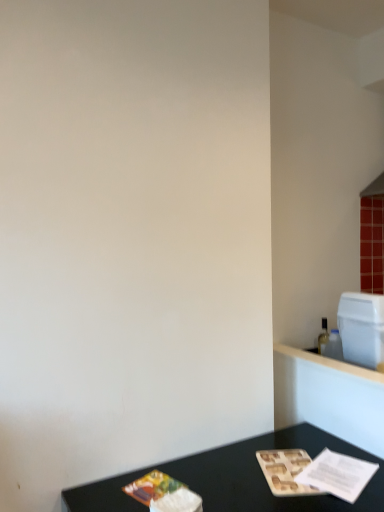
Question: From a real-world perspective, relative to black matte table at lower center, is white plastic container at upper right vertically above or below?

Choices:
 (A) above
 (B) below

Answer: (A)

Question: Is white plastic container at upper right wider or thinner than black matte table at lower center?

Choices:
 (A) wide
 (B) thin

Answer: (B)

Question: Is white plastic container at upper right inside the boundaries of black matte table at lower center, or outside?

Choices:
 (A) outside
 (B) inside

Answer: (A)

Question: Is black matte table at lower center taller or shorter than white plastic container at upper right?

Choices:
 (A) short
 (B) tall

Answer: (B)

Question: From a real-world perspective, is black matte table at lower center positioned above or below white plastic container at upper right?

Choices:
 (A) above
 (B) below

Answer: (B)

Question: Considering the positions of point (274, 446) and point (342, 293), is point (274, 446) closer or farther from the camera than point (342, 293)?

Choices:
 (A) farther
 (B) closer

Answer: (B)

Question: In terms of width, does black matte table at lower center look wider or thinner when compared to white plastic container at upper right?

Choices:
 (A) thin
 (B) wide

Answer: (B)